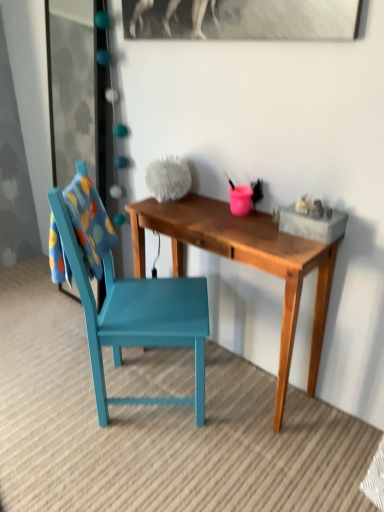
Locate an element on the screen. free space to the left of wooden desk at center is located at coordinates (63, 399).